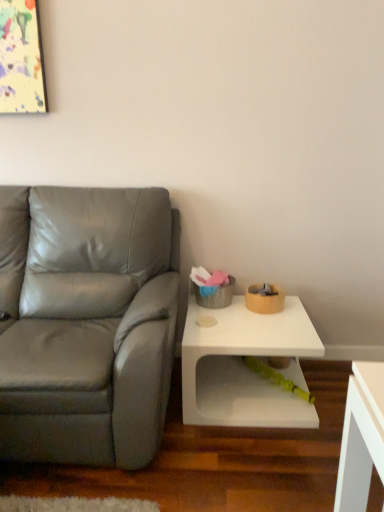
The width and height of the screenshot is (384, 512). What are the coordinates of `space that is in front of rubberized green toy at lower center` in the screenshot? It's located at (279, 422).